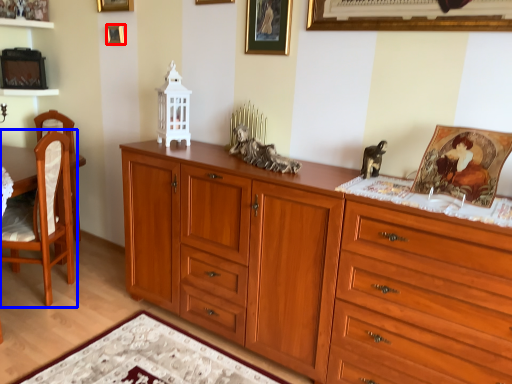
Question: Which object is further to the camera taking this photo, picture frame (highlighted by a red box) or chair (highlighted by a blue box)?

Choices:
 (A) picture frame
 (B) chair

Answer: (A)